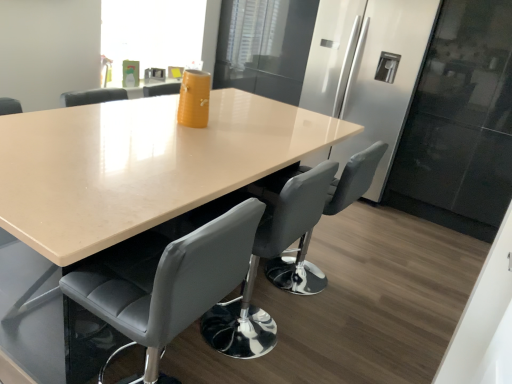
Question: Should I look upward or downward to see gray leather chair at center, the second chair viewed from the back?

Choices:
 (A) up
 (B) down

Answer: (B)

Question: Is beige glossy table at center looking in the opposite direction of gray leather chair at center, placed as the 2th chair when sorted from front to back?

Choices:
 (A) yes
 (B) no

Answer: (A)

Question: Considering the relative sizes of beige glossy table at center and gray leather chair at center, the first chair in the back-to-front sequence, in the image provided, is beige glossy table at center bigger than gray leather chair at center, the first chair in the back-to-front sequence,?

Choices:
 (A) no
 (B) yes

Answer: (B)

Question: From the image's perspective, would you say beige glossy table at center is shown under gray leather chair at center, placed as the 2th chair when sorted from front to back?

Choices:
 (A) no
 (B) yes

Answer: (A)

Question: Does beige glossy table at center have a lesser width compared to gray leather chair at center, the first chair in the back-to-front sequence?

Choices:
 (A) no
 (B) yes

Answer: (A)

Question: Does beige glossy table at center have a smaller size compared to gray leather chair at center, placed as the 2th chair when sorted from front to back?

Choices:
 (A) yes
 (B) no

Answer: (B)

Question: Is beige glossy table at center not within gray leather chair at center, placed as the 2th chair when sorted from front to back?

Choices:
 (A) no
 (B) yes

Answer: (B)

Question: Is transparent glass window screen at upper center taller than gray leather chair at center, the second chair viewed from the back?

Choices:
 (A) no
 (B) yes

Answer: (A)

Question: From a real-world perspective, is transparent glass window screen at upper center over gray leather chair at center, the second chair viewed from the back?

Choices:
 (A) no
 (B) yes

Answer: (B)

Question: Is transparent glass window screen at upper center facing towards gray leather chair at center, the 1th chair viewed from the front?

Choices:
 (A) no
 (B) yes

Answer: (A)

Question: Is transparent glass window screen at upper center smaller than gray leather chair at center, the 1th chair viewed from the front?

Choices:
 (A) no
 (B) yes

Answer: (A)

Question: Can you confirm if transparent glass window screen at upper center is bigger than gray leather chair at center, the second chair viewed from the back?

Choices:
 (A) yes
 (B) no

Answer: (A)

Question: From the image's perspective, is transparent glass window screen at upper center on top of gray leather chair at center, the 1th chair viewed from the front?

Choices:
 (A) no
 (B) yes

Answer: (B)

Question: Is sleek stainless steel fridge at center further to camera compared to gray leather chair at center, the 1th chair viewed from the front?

Choices:
 (A) no
 (B) yes

Answer: (B)